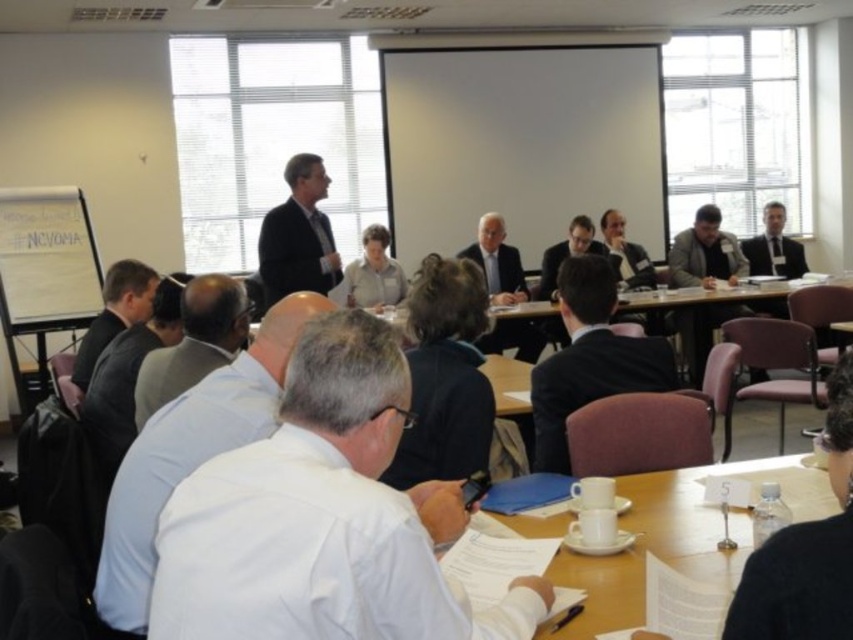
Is point (281, 483) positioned before point (693, 250)?

Yes, it is in front of point (693, 250).

Can you confirm if white shirt at center is smaller than dark gray suit at center?

Yes.

The width and height of the screenshot is (853, 640). What do you see at coordinates (323, 516) in the screenshot? I see `white shirt at center` at bounding box center [323, 516].

I want to click on white shirt at center, so click(323, 516).

Is white paper at center above dark suit at center?

No.

Is white paper at center shorter than dark suit at center?

Correct, white paper at center is not as tall as dark suit at center.

Where is `white paper at center`? The image size is (853, 640). white paper at center is located at coordinates (676, 538).

Between black suit at center and dark gray suit at left, which one has more height?

Standing taller between the two is black suit at center.

Does black suit at center have a greater width compared to dark gray suit at left?

Correct, the width of black suit at center exceeds that of dark gray suit at left.

Which is in front, point (590, 269) or point (113, 326)?

Point (590, 269) is more forward.

Where is `black suit at center`? The height and width of the screenshot is (640, 853). black suit at center is located at coordinates point(589,358).